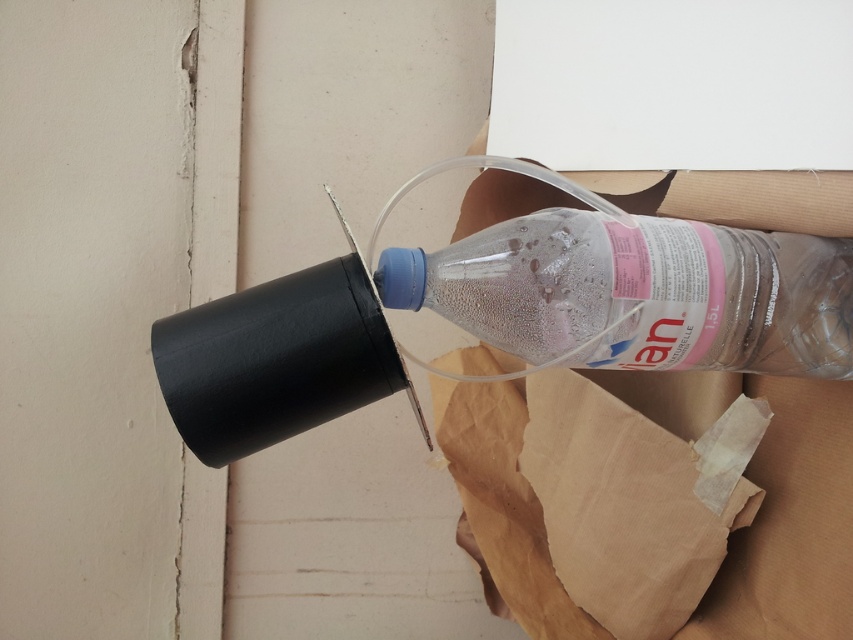
Which is in front, point (476, 348) or point (340, 330)?

Point (340, 330) is in front.

Find the location of a particular element. The image size is (853, 640). transparent paper at upper right is located at coordinates (653, 504).

Is black matte wine bottle at upper center thinner than transparent plastic bottle at center?

Incorrect, black matte wine bottle at upper center's width is not less than transparent plastic bottle at center's.

What do you see at coordinates (502, 317) in the screenshot? Image resolution: width=853 pixels, height=640 pixels. I see `black matte wine bottle at upper center` at bounding box center [502, 317].

Is point (502, 321) positioned in front of point (741, 298)?

No, (502, 321) is behind (741, 298).

Locate an element on the screen. The width and height of the screenshot is (853, 640). black matte wine bottle at upper center is located at coordinates (502, 317).

Between point (693, 403) and point (773, 324), which one is positioned in front?

Point (773, 324)

Image resolution: width=853 pixels, height=640 pixels. What are the coordinates of `transparent paper at upper right` in the screenshot? It's located at [653, 504].

I want to click on transparent paper at upper right, so click(653, 504).